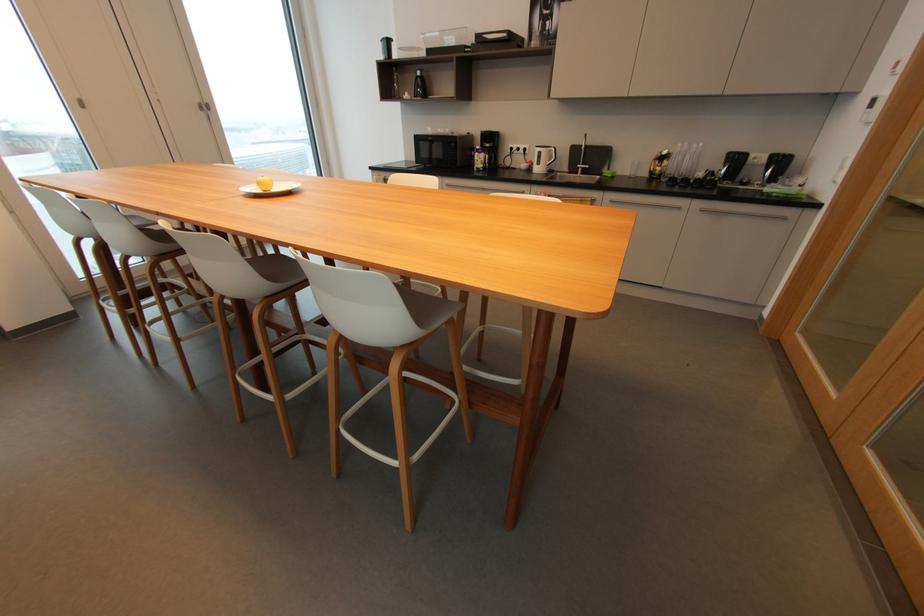
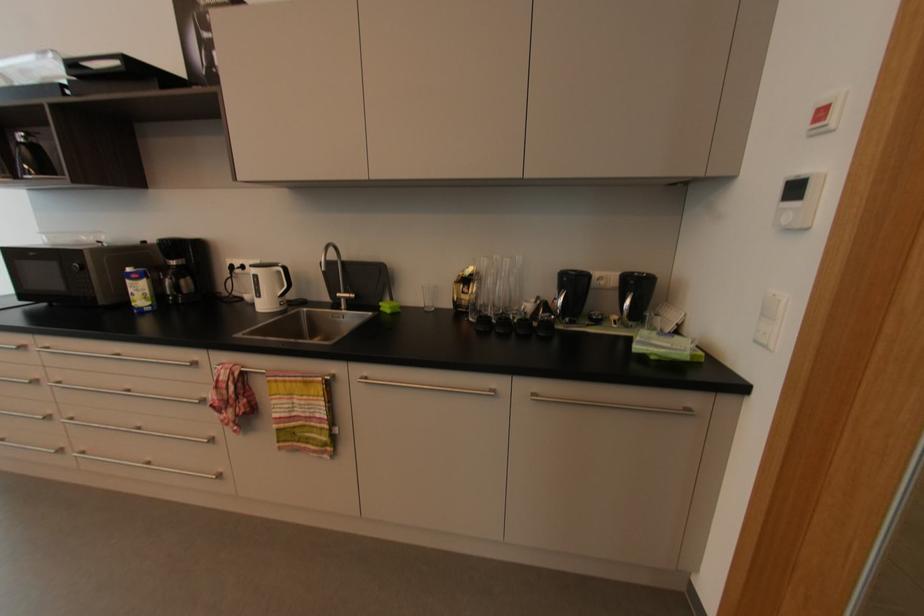
Find the pixel in the second image that matches [554,151] in the first image.

(282, 273)